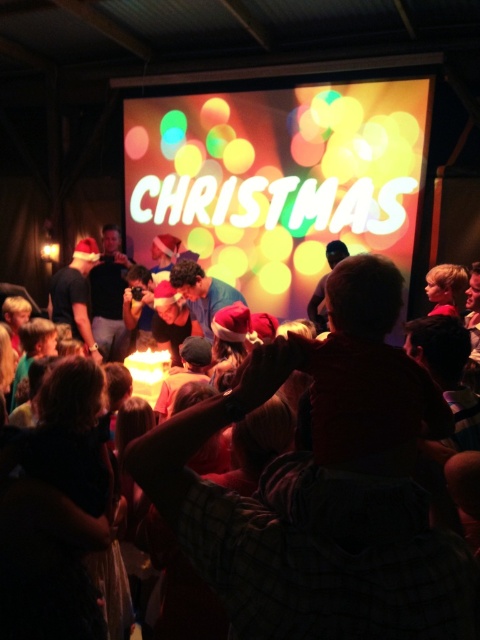
Question: Is matte red hat at center closer to the viewer compared to matte black shirt at center?

Choices:
 (A) no
 (B) yes

Answer: (B)

Question: Can you confirm if neon sign at center is smaller than matte black shirt at center?

Choices:
 (A) no
 (B) yes

Answer: (A)

Question: Which object is the farthest from the neon sign at center?

Choices:
 (A) matte black shirt at center
 (B) matte red hat at center

Answer: (B)

Question: Which object is closer to the camera taking this photo?

Choices:
 (A) matte red hat at center
 (B) neon sign at center
 (C) matte black shirt at center

Answer: (A)

Question: Which point is closer to the camera?

Choices:
 (A) (376, 381)
 (B) (76, 316)

Answer: (A)

Question: Does matte red hat at center have a smaller size compared to matte black shirt at center?

Choices:
 (A) no
 (B) yes

Answer: (B)